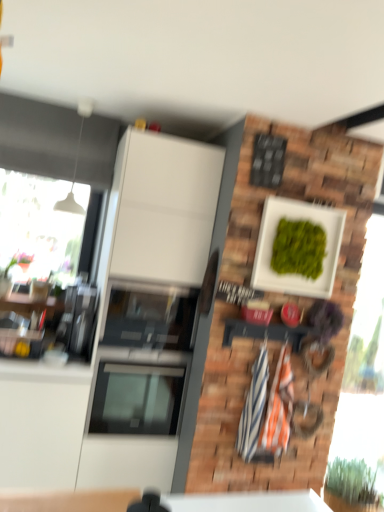
Question: From the image's perspective, is green leafy plant at lower right located above white matte wall at upper center?

Choices:
 (A) yes
 (B) no

Answer: (B)

Question: From a real-world perspective, is green leafy plant at lower right beneath white matte wall at upper center?

Choices:
 (A) yes
 (B) no

Answer: (A)

Question: Can you confirm if green leafy plant at lower right is positioned to the left of white matte wall at upper center?

Choices:
 (A) yes
 (B) no

Answer: (B)

Question: Is green leafy plant at lower right not close to white matte wall at upper center?

Choices:
 (A) yes
 (B) no

Answer: (A)

Question: Would you say green leafy plant at lower right contains white matte wall at upper center?

Choices:
 (A) yes
 (B) no

Answer: (B)

Question: Is white glossy cabinet at center in front of or behind green leafy plant at lower right in the image?

Choices:
 (A) front
 (B) behind

Answer: (A)

Question: Looking at their shapes, would you say white glossy cabinet at center is wider or thinner than green leafy plant at lower right?

Choices:
 (A) wide
 (B) thin

Answer: (A)

Question: From a real-world perspective, is white glossy cabinet at center above or below green leafy plant at lower right?

Choices:
 (A) above
 (B) below

Answer: (A)

Question: Looking at the image, does white glossy cabinet at center seem bigger or smaller compared to green leafy plant at lower right?

Choices:
 (A) small
 (B) big

Answer: (B)

Question: Considering their positions, is white matte wall at upper center located in front of or behind white glossy cabinet at center?

Choices:
 (A) front
 (B) behind

Answer: (A)

Question: Is white matte wall at upper center bigger or smaller than white glossy cabinet at center?

Choices:
 (A) small
 (B) big

Answer: (A)

Question: From a real-world perspective, relative to white glossy cabinet at center, is white matte wall at upper center vertically above or below?

Choices:
 (A) above
 (B) below

Answer: (A)

Question: From the image's perspective, relative to white glossy cabinet at center, is white matte wall at upper center above or below?

Choices:
 (A) below
 (B) above

Answer: (B)

Question: In terms of width, does green leafy plant at lower right look wider or thinner when compared to white matte wall at upper center?

Choices:
 (A) wide
 (B) thin

Answer: (B)

Question: Is green leafy plant at lower right in front of or behind white matte wall at upper center in the image?

Choices:
 (A) front
 (B) behind

Answer: (B)